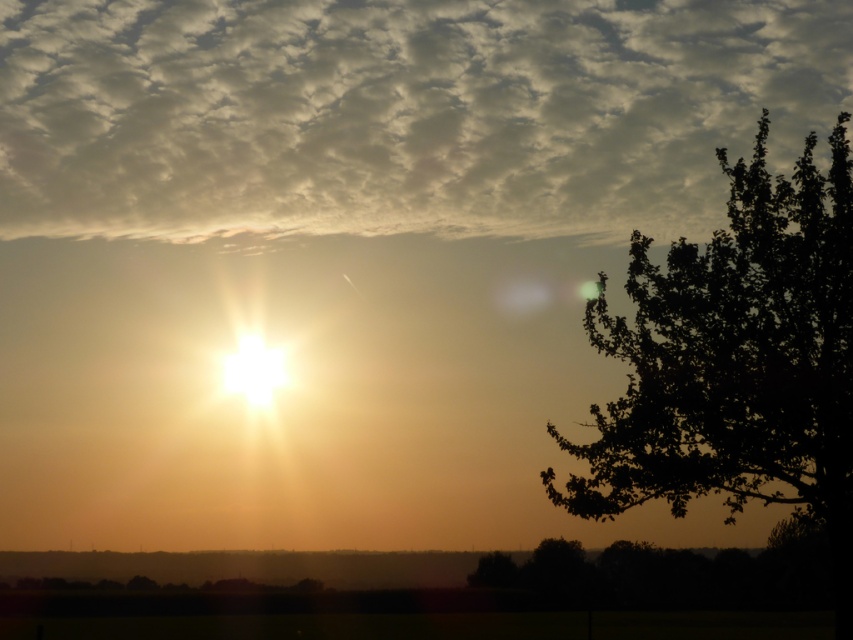
You are an astronomer analyzing the sunset scene. You need to determine the position of the cloudy sky at upper center in the image. What are its coordinates?

The cloudy sky at upper center is located at coordinates point (399, 113).

You are an artist trying to paint this sunset scene. You want to ensure the cloudy sky at upper center and the dark green leafy tree at right are proportionally accurate. Which object should you paint larger in your artwork?

The cloudy sky at upper center should be painted larger than the dark green leafy tree at right because it is described as having a larger size compared to the dark green leafy tree at right.